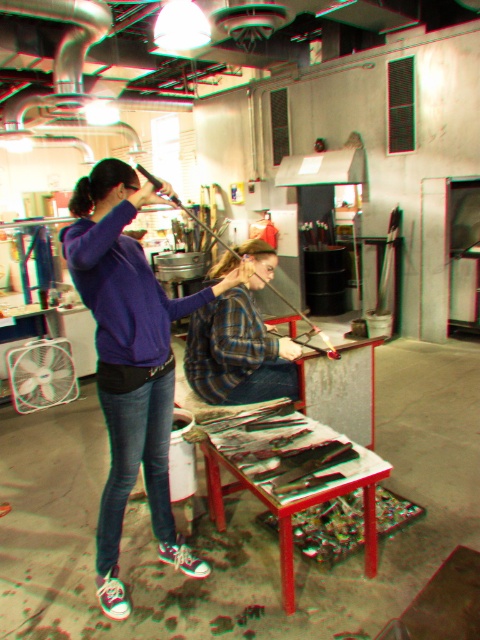
You are an observer in the glassblowing workshop. You notice two people in the foreground. The first person is wearing a plaid fabric shirt at center and denim jeans at center. Which piece of clothing is larger in size?

The plaid fabric shirt at center is bigger than the denim jeans at center.

Looking at this image, you are a visitor observing the glassblowing workshop. You see the purple matte hoodie at upper left and the wooden table at center. Which object is positioned higher in the image?

The purple matte hoodie at upper left is located above the wooden table at center, so it is positioned higher in the image.

In the scene shown: What is located at the coordinates point (130, 362)?

The purple matte hoodie at upper left is located at point (130, 362).